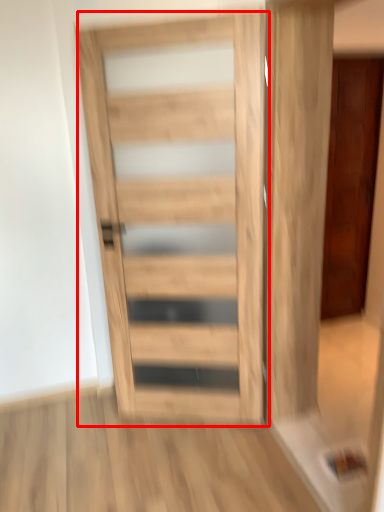
Question: From the image's perspective, where is door (annotated by the red box) located in relation to door in the image?

Choices:
 (A) above
 (B) below

Answer: (B)